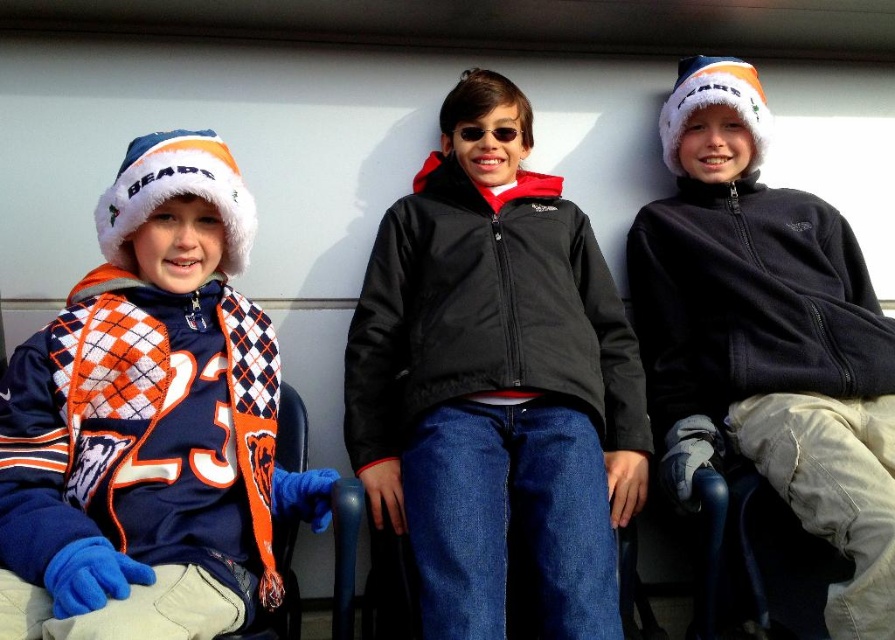
Question: Is black softshell jacket at center below dark blue fleece jacket at center?

Choices:
 (A) yes
 (B) no

Answer: (A)

Question: Is the position of argyle knit scarf at left more distant than that of dark blue fleece jacket at center?

Choices:
 (A) no
 (B) yes

Answer: (A)

Question: Can you confirm if black softshell jacket at center is positioned to the left of dark blue fleece jacket at center?

Choices:
 (A) yes
 (B) no

Answer: (A)

Question: Which point is farther from the camera taking this photo?

Choices:
 (A) (730, 380)
 (B) (194, 316)

Answer: (A)

Question: Which object is closer to the camera taking this photo?

Choices:
 (A) black softshell jacket at center
 (B) argyle knit scarf at left

Answer: (B)

Question: Among these objects, which one is nearest to the camera?

Choices:
 (A) dark blue fleece jacket at center
 (B) black softshell jacket at center

Answer: (B)